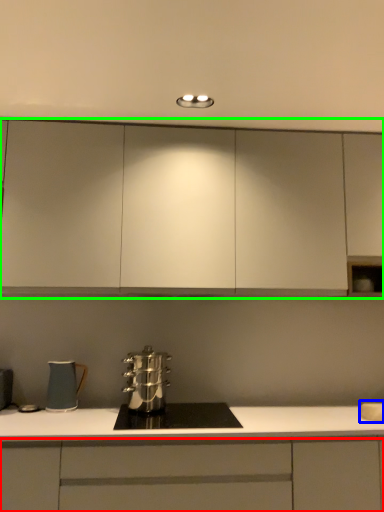
Question: Based on their relative distances, which object is farther from cabinetry (highlighted by a red box)? Choose from sink (highlighted by a blue box) and cabinetry (highlighted by a green box).

Choices:
 (A) sink
 (B) cabinetry

Answer: (B)